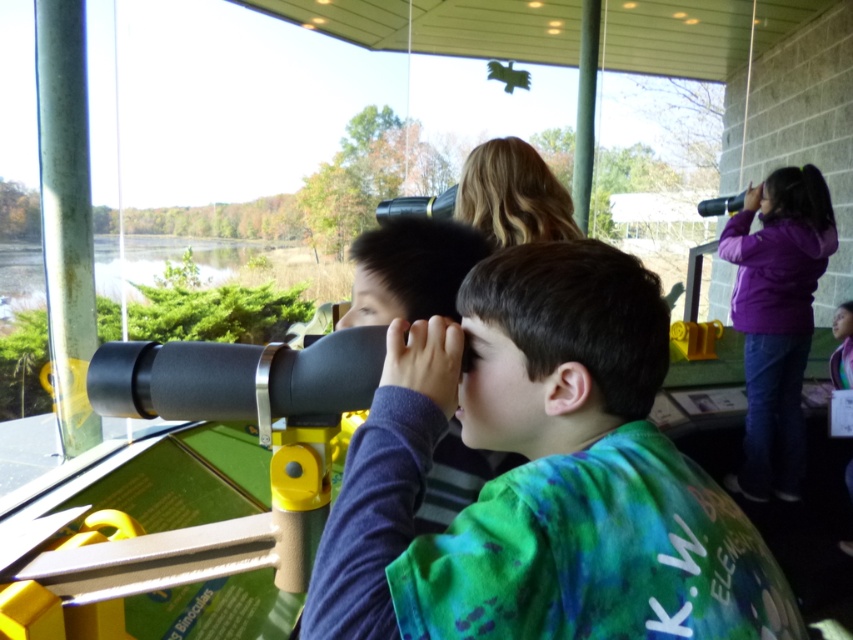
You are standing on the observation deck and want to locate the matte black telescope at center. According to the coordinates provided, where should you look?

The matte black telescope at center is located at the 2D coordinates point [543,477].

You are a birdwatcher trying to set up your equipment on a small table. You have both the matte black telescope at center and the matte black binoculars at center. Which one should you place first if you want to ensure there is enough space for both?

You should place the matte black telescope at center first since it occupies less space than the matte black binoculars at center, allowing room for both items on the table.